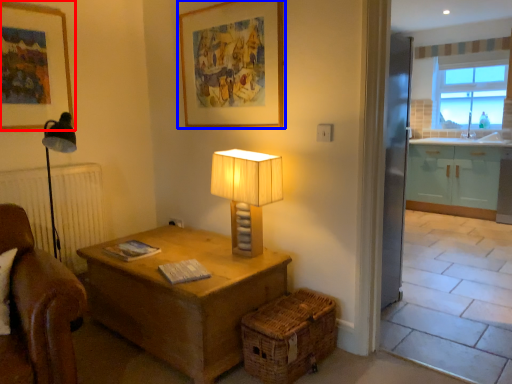
Question: Among these objects, which one is farthest to the camera, picture frame (highlighted by a red box) or picture frame (highlighted by a blue box)?

Choices:
 (A) picture frame
 (B) picture frame

Answer: (A)